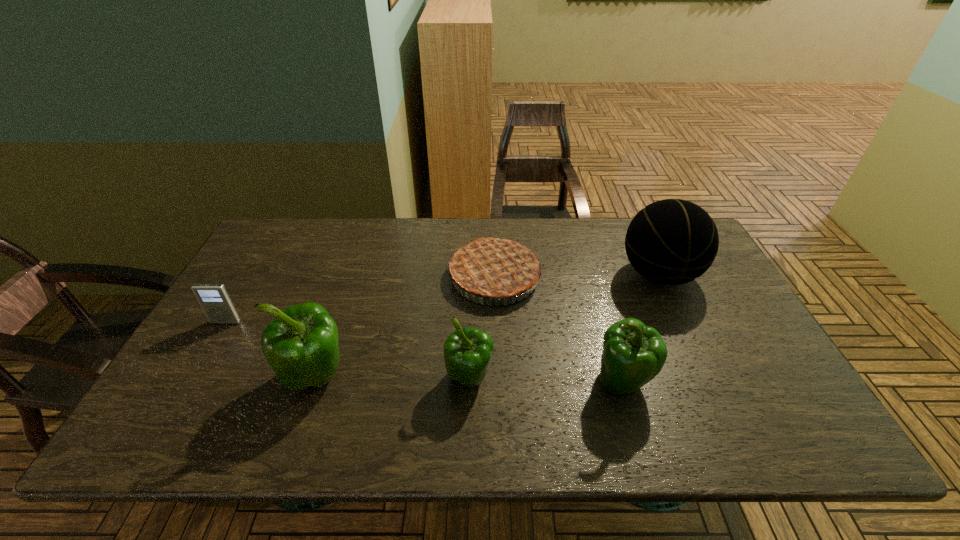
Image resolution: width=960 pixels, height=540 pixels. Identify the location of empty location between the rightmost object and the shortest object. click(x=443, y=299).

Point out which object is positioned as the fifth nearest to the fifth object from right to left. Please provide its 2D coordinates. Your answer should be formatted as a tuple, i.e. [(x, y)], where the tuple contains the x and y coordinates of a point satisfying the conditions above.

[(670, 242)]

Choose which object is the fourth nearest neighbor to the shortest bell pepper. Please provide its 2D coordinates. Your answer should be formatted as a tuple, i.e. [(x, y)], where the tuple contains the x and y coordinates of a point satisfying the conditions above.

[(670, 242)]

The image size is (960, 540). In order to click on bell pepper object that ranks as the closest to the shortest bell pepper in this screenshot , I will do click(301, 344).

Image resolution: width=960 pixels, height=540 pixels. I want to click on bell pepper that stands as the second closest to the second object from left to right, so click(x=633, y=354).

Locate an element on the screen. This screenshot has width=960, height=540. vacant space that satisfies the following two spatial constraints: 1. on the front side of the second bell pepper from right to left; 2. on the right side of the second object from left to right is located at coordinates (317, 379).

What are the coordinates of `vacant space that satisfies the following two spatial constraints: 1. on the front-facing side of the third farthest object; 2. on the left side of the shortest bell pepper` in the screenshot? It's located at (193, 379).